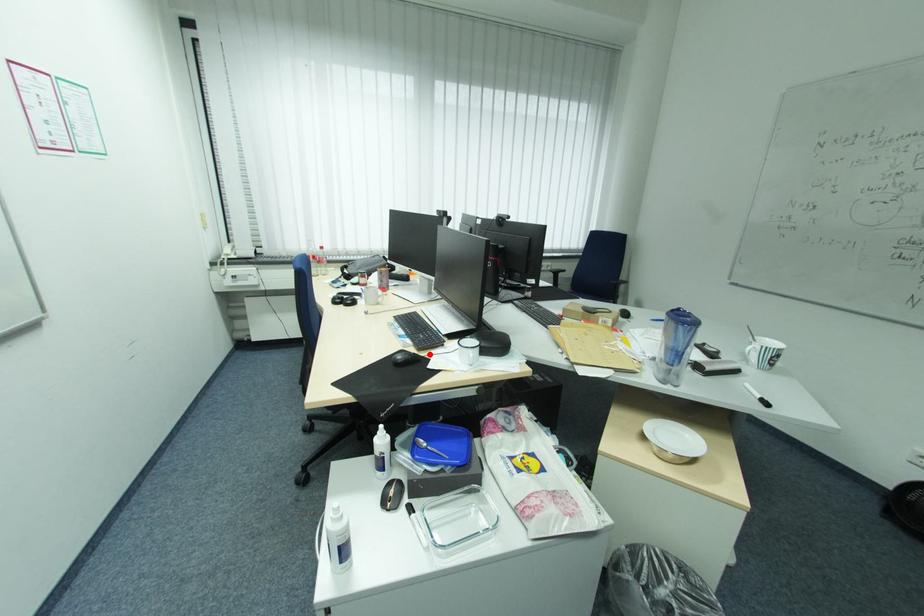
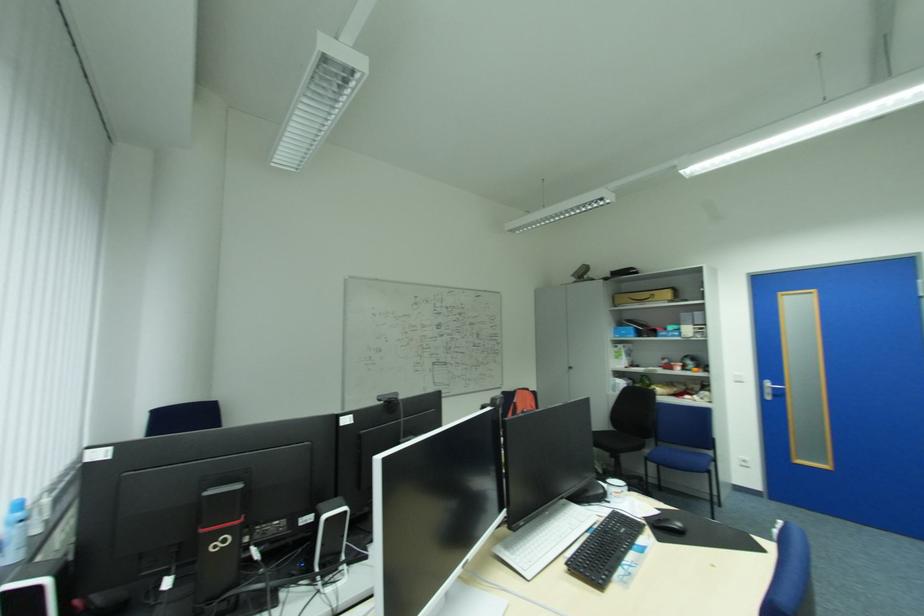
Where in the second image is the point corresponding to the highlighted location from the first image?

(652, 524)